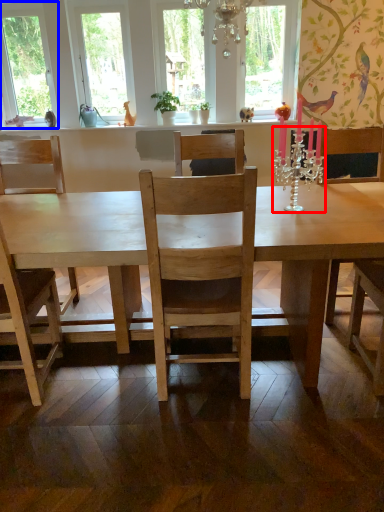
Question: Which object appears closest to the camera in this image, candle holder (highlighted by a red box) or window (highlighted by a blue box)?

Choices:
 (A) candle holder
 (B) window

Answer: (A)